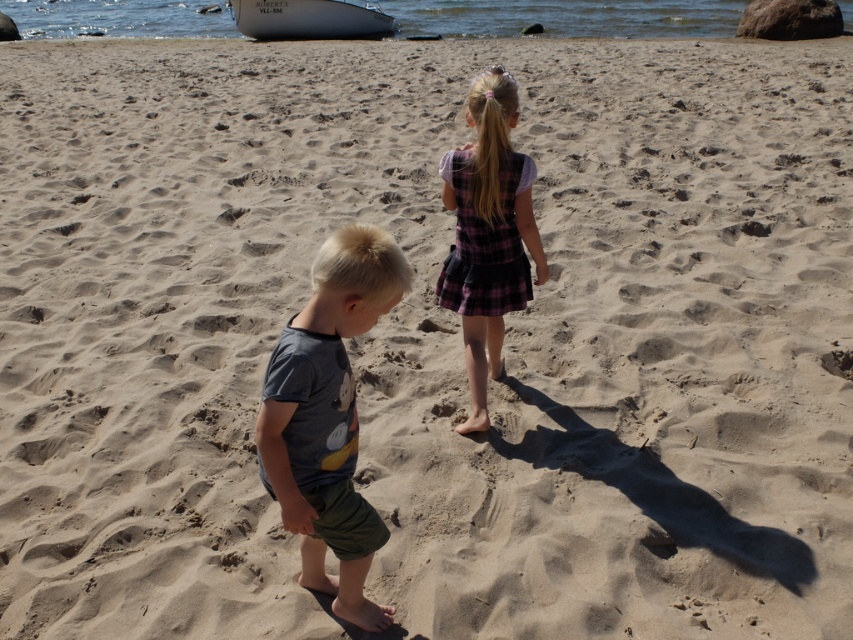
Question: From the image, what is the correct spatial relationship of dark gray cotton shirt at center in relation to plaid fabric dress at center?

Choices:
 (A) below
 (B) above

Answer: (A)

Question: Does dark gray cotton shirt at center have a greater width compared to plaid fabric dress at center?

Choices:
 (A) yes
 (B) no

Answer: (B)

Question: Is dark gray cotton shirt at center closer to camera compared to white glossy boat at upper center?

Choices:
 (A) no
 (B) yes

Answer: (B)

Question: Considering the real-world distances, which object is farthest from the plaid fabric dress at center?

Choices:
 (A) white glossy boat at upper center
 (B) dark gray cotton shirt at center

Answer: (A)

Question: Which object is farther from the camera taking this photo?

Choices:
 (A) plaid fabric dress at center
 (B) white glossy boat at upper center

Answer: (B)

Question: Which object is the farthest from the plaid fabric dress at center?

Choices:
 (A) dark gray cotton shirt at center
 (B) white glossy boat at upper center

Answer: (B)